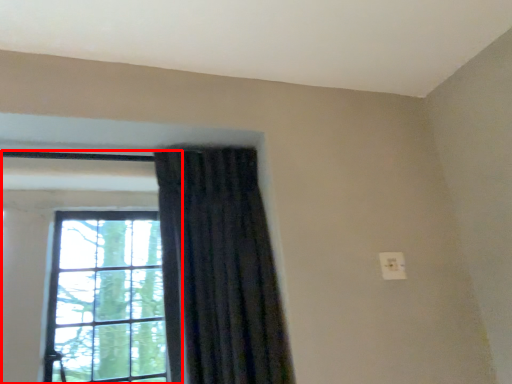
Question: Where is window (annotated by the red box) located in relation to curtain in the image?

Choices:
 (A) right
 (B) left

Answer: (B)